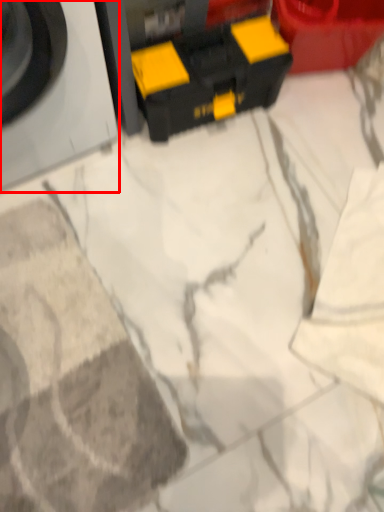
Question: From the image's perspective, what is the correct spatial positioning of washing machine (annotated by the red box) in reference to toy?

Choices:
 (A) below
 (B) above

Answer: (B)